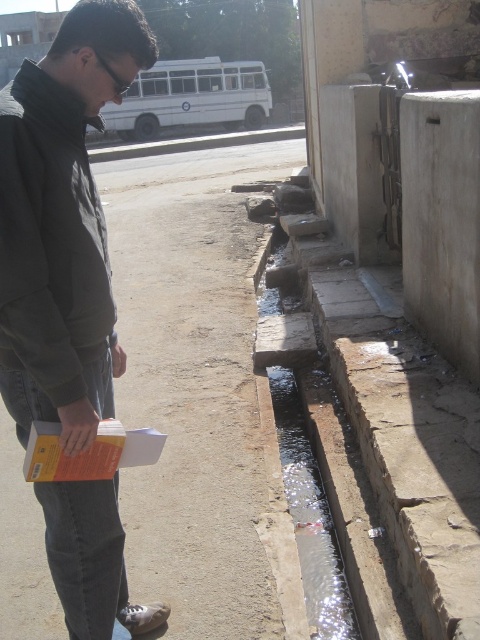
Question: Among these points, which one is farthest from the camera?

Choices:
 (A) (298, 520)
 (B) (74, 428)

Answer: (A)

Question: Can you confirm if dark gray jacket at left is positioned below white matte bus at upper center?

Choices:
 (A) yes
 (B) no

Answer: (A)

Question: Is clear glass puddle at lower center smaller than white matte bus at upper center?

Choices:
 (A) yes
 (B) no

Answer: (A)

Question: Which point is farther to the camera?

Choices:
 (A) clear glass puddle at lower center
 (B) dark gray jacket at left

Answer: (A)

Question: Is dark gray jacket at left to the left of white matte bus at upper center from the viewer's perspective?

Choices:
 (A) no
 (B) yes

Answer: (A)

Question: Which object is the farthest from the white matte bus at upper center?

Choices:
 (A) dark gray jacket at left
 (B) clear glass puddle at lower center

Answer: (A)